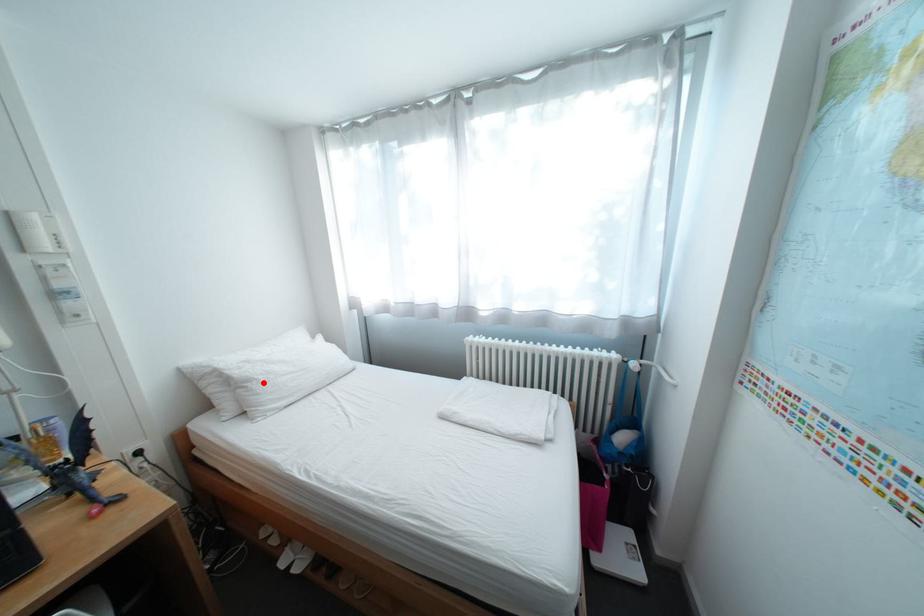
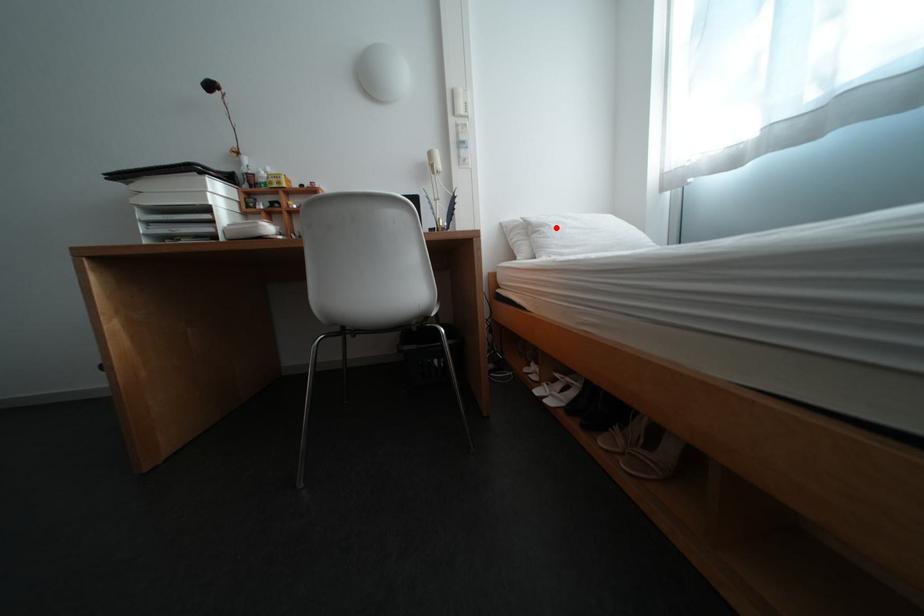
I am providing you with two images of the same scene from different viewpoints. A red point is marked on the first image and another point is marked on the second image. Is the marked point in image1 the same physical position as the marked point in image2?

Yes